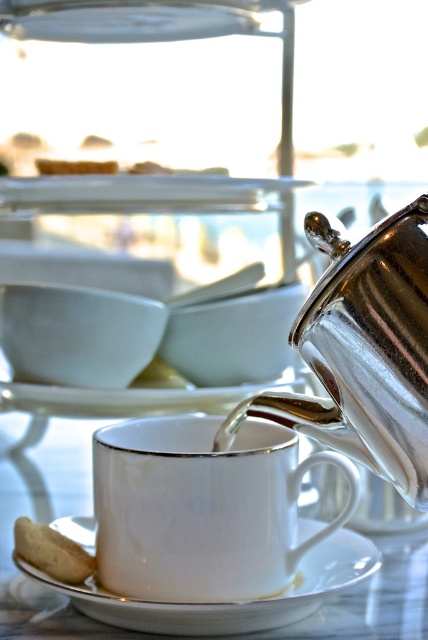
Question: Which point appears farthest from the camera in this image?

Choices:
 (A) pyautogui.click(x=149, y=624)
 (B) pyautogui.click(x=89, y=401)

Answer: (B)

Question: Does white porcelain cup at center come behind white ceramic saucer at center?

Choices:
 (A) yes
 (B) no

Answer: (A)

Question: Which point appears farthest from the camera in this image?

Choices:
 (A) (421, 250)
 (B) (281, 605)
 (C) (106, 172)

Answer: (C)

Question: Does white porcelain plate at center appear over green matte cookie at center?

Choices:
 (A) no
 (B) yes

Answer: (A)

Question: Estimate the real-world distances between objects in this image. Which object is farther from the shiny metallic teapot at center?

Choices:
 (A) white fluffy bread at lower left
 (B) white ceramic saucer at center
 (C) green matte cookie at center
 (D) white porcelain plate at center

Answer: (C)

Question: Can you confirm if white porcelain cup at center is smaller than shiny metallic teapot at center?

Choices:
 (A) no
 (B) yes

Answer: (B)